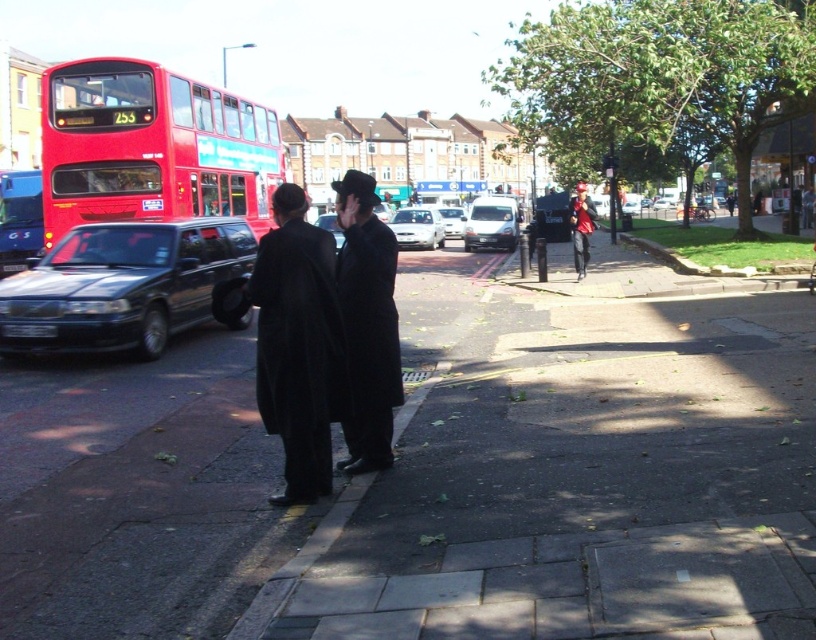
You are a delivery person who needs to place a small package between the black matte coat at center and the white glossy car at center. Considering their heights, which object should the package be placed closer to?

The black matte coat at center is not as tall as the white glossy car at center, so the package should be placed closer to the black matte coat at center to ensure stability and visibility.

You are a pedestrian standing at the center of the sidewalk in the image. There is a matte black coat at center represented by point (x=327, y=337). Can you see the red double decker bus in the background from your current position?

Yes, the matte black coat at center is located at point (x=327, y=337), which is at the center of the sidewalk. Since the red double decker bus is positioned on the left side of the frame in the background, it should be visible from that central position unless obstructed by other objects. The scene description mentions no obstructions, so the bus is visible.